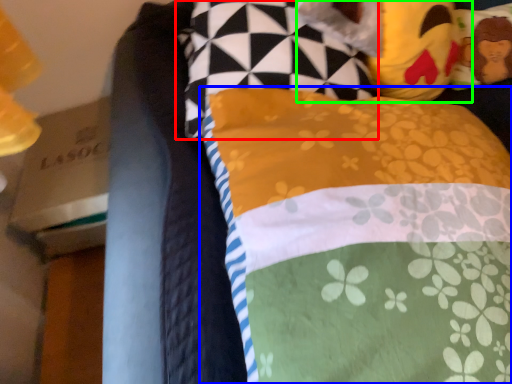
Question: Considering the real-world distances, which object is closest to pillow (highlighted by a red box)? pillow (highlighted by a blue box) or figurine (highlighted by a green box).

Choices:
 (A) pillow
 (B) figurine

Answer: (B)